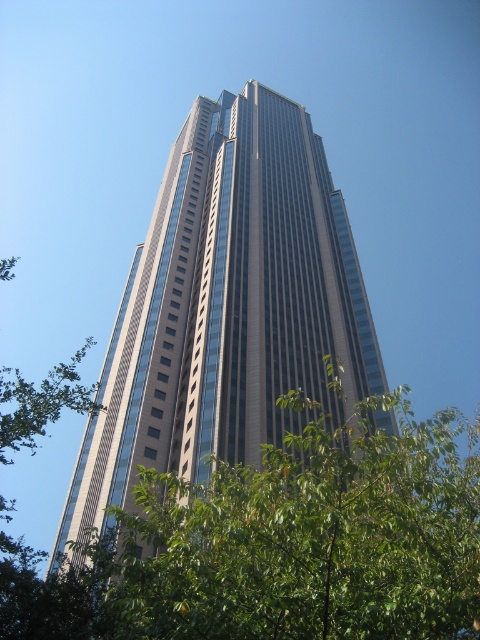
You are a photographer standing in front of the glassy steel skyscraper at center and the green leafy tree at center. You want to capture a photo where both objects are in the frame. Which object should you position closer to the edge of the frame to ensure both fit?

Since the glassy steel skyscraper at center is wider than the green leafy tree at center, you should position the glassy steel skyscraper at center closer to the edge of the frame to ensure both fit in the photo.

You are a bird flying over the city and want to land on the green leafy tree at center. From your current position above the glassy steel skyscraper at center, which direction should you fly to reach the tree?

The green leafy tree at center is below the glassy steel skyscraper at center, so you should fly downward to reach the tree.